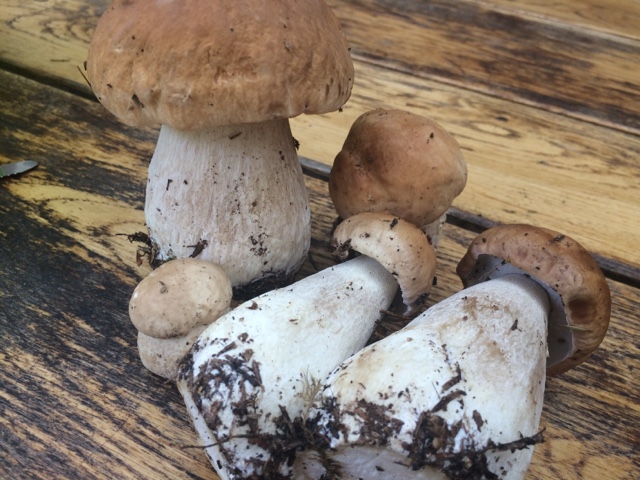
At what (x,y) coordinates should I click in order to perform the action: click on color photo depicting mushrooms on a table. Please return your answer as a coordinate pair (x, y). Looking at the image, I should click on (521, 92), (539, 171).